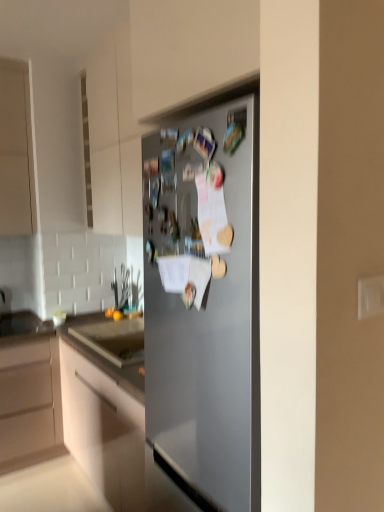
Identify the location of matte white cabinet at center. (95, 418).

Measure the distance between point (115,383) and camera.

A distance of 6.47 feet exists between point (115,383) and camera.

What do you see at coordinates (95, 418) in the screenshot? I see `matte white cabinet at center` at bounding box center [95, 418].

This screenshot has width=384, height=512. Describe the element at coordinates (204, 304) in the screenshot. I see `satin silver fridge at center` at that location.

This screenshot has height=512, width=384. I want to click on satin silver fridge at center, so click(x=204, y=304).

Where is `matte white cabinet at center`? matte white cabinet at center is located at coordinates 95,418.

Looking at this image, can you confirm if matte white cabinet at center is positioned to the left of satin silver fridge at center?

Yes.

Considering their positions, is matte white cabinet at center located in front of or behind satin silver fridge at center?

Visually, matte white cabinet at center is located behind satin silver fridge at center.

Considering the points (70, 327) and (158, 304), which point is behind, point (70, 327) or point (158, 304)?

Positioned behind is point (70, 327).

Based on the photo, from the image's perspective, is matte white cabinet at center beneath satin silver fridge at center?

Yes, from the image's perspective, matte white cabinet at center is beneath satin silver fridge at center.

From a real-world perspective, is matte white cabinet at center on top of satin silver fridge at center?

No, from a real-world perspective, matte white cabinet at center is not on top of satin silver fridge at center.

Considering the relative sizes of matte white cabinet at center and satin silver fridge at center in the image provided, is matte white cabinet at center wider than satin silver fridge at center?

Indeed, matte white cabinet at center has a greater width compared to satin silver fridge at center.

Does matte white cabinet at center have a lesser height compared to satin silver fridge at center?

No, matte white cabinet at center is not shorter than satin silver fridge at center.

Considering the sizes of objects matte white cabinet at center and satin silver fridge at center in the image provided, who is smaller, matte white cabinet at center or satin silver fridge at center?

Smaller between the two is satin silver fridge at center.

Would you say satin silver fridge at center is part of matte white cabinet at center's contents?

No, satin silver fridge at center is located outside of matte white cabinet at center.

Is matte white cabinet at center not close to satin silver fridge at center?

They are positioned close to each other.

Is matte white cabinet at center facing away from satin silver fridge at center?

matte white cabinet at center is not turned away from satin silver fridge at center.

What's the angular difference between matte white cabinet at center and satin silver fridge at center's facing directions?

92.4 degrees.

The image size is (384, 512). I want to click on cabinetry on the left of satin silver fridge at center, so click(95, 418).

Considering the positions of objects satin silver fridge at center and matte white cabinet at center in the image provided, who is more to the left, satin silver fridge at center or matte white cabinet at center?

matte white cabinet at center.

In the image, is satin silver fridge at center positioned in front of or behind matte white cabinet at center?

satin silver fridge at center is positioned closer to the viewer than matte white cabinet at center.

Is point (145, 150) closer to camera compared to point (122, 441)?

No, it is not.

From the image's perspective, is satin silver fridge at center positioned above or below matte white cabinet at center?

Clearly, from the image's perspective, satin silver fridge at center is above matte white cabinet at center.

Looking at this image, from a real-world perspective, relative to matte white cabinet at center, is satin silver fridge at center vertically above or below?

satin silver fridge at center is situated higher than matte white cabinet at center in the real world.

Which of these two, satin silver fridge at center or matte white cabinet at center, is thinner?

Thinner between the two is satin silver fridge at center.

Which of these two, satin silver fridge at center or matte white cabinet at center, stands taller?

matte white cabinet at center.

Considering the relative sizes of satin silver fridge at center and matte white cabinet at center in the image provided, is satin silver fridge at center bigger than matte white cabinet at center?

No.

Would you say satin silver fridge at center contains matte white cabinet at center?

No, matte white cabinet at center is not inside satin silver fridge at center.

Is satin silver fridge at center directly adjacent to matte white cabinet at center?

satin silver fridge at center is not next to matte white cabinet at center, and they're not touching.

Is satin silver fridge at center oriented towards matte white cabinet at center?

No, satin silver fridge at center is not turned towards matte white cabinet at center.

How many degrees apart are the facing directions of satin silver fridge at center and matte white cabinet at center?

92.4 degrees.

Where is `refrigerator that is on the right side of matte white cabinet at center`? Image resolution: width=384 pixels, height=512 pixels. refrigerator that is on the right side of matte white cabinet at center is located at coordinates (204, 304).

The height and width of the screenshot is (512, 384). I want to click on cabinetry located on the left of satin silver fridge at center, so click(x=95, y=418).

The height and width of the screenshot is (512, 384). Identify the location of refrigerator above the matte white cabinet at center (from a real-world perspective). (204, 304).